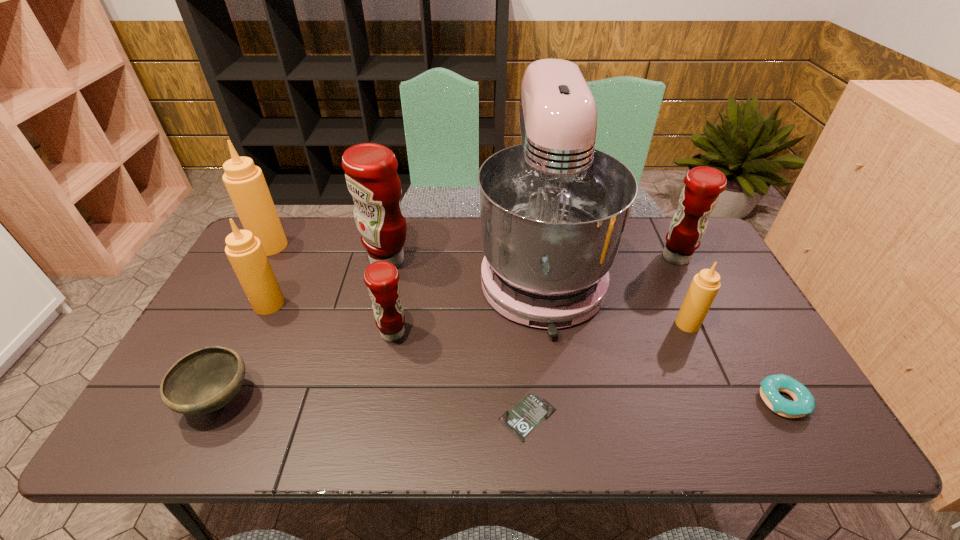
Locate an element on the screen. object present at the near right corner is located at coordinates (804, 403).

In the image, there is a desktop. Identify the location of vacant space at the far edge. This screenshot has width=960, height=540. (463, 245).

Where is `vacant space at the near edge of the desktop`? This screenshot has width=960, height=540. vacant space at the near edge of the desktop is located at coordinates (384, 418).

Identify the location of free space at the left edge of the desktop. The image size is (960, 540). (254, 340).

Where is `blank area at the right edge`? blank area at the right edge is located at coordinates (735, 294).

In the image, there is a desktop. Where is `free space at the far right corner`? The image size is (960, 540). free space at the far right corner is located at coordinates (702, 247).

The width and height of the screenshot is (960, 540). I want to click on vacant space that's between the biggest tan condiment and the biggest red condiment, so click(329, 253).

Find the location of a particular element. The height and width of the screenshot is (540, 960). free area in between the nearest red condiment and the rightmost tan condiment is located at coordinates (540, 328).

Locate an element on the screen. The image size is (960, 540). free space between the second biggest red condiment and the biggest tan condiment is located at coordinates (473, 252).

Identify the location of vacant space that is in between the identity card and the ninth tallest object. (655, 409).